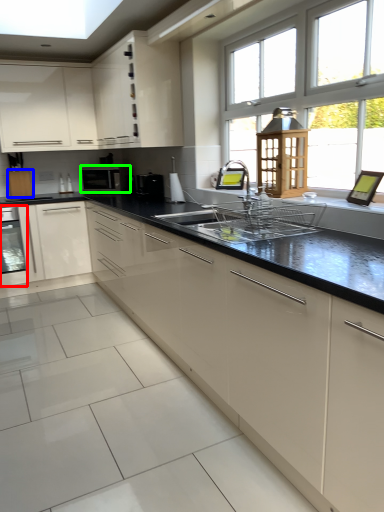
Question: Estimate the real-world distances between objects in this image. Which object is farther from home appliance (highlighted by a red box), cabinetry (highlighted by a blue box) or kitchen appliance (highlighted by a green box)?

Choices:
 (A) cabinetry
 (B) kitchen appliance

Answer: (B)